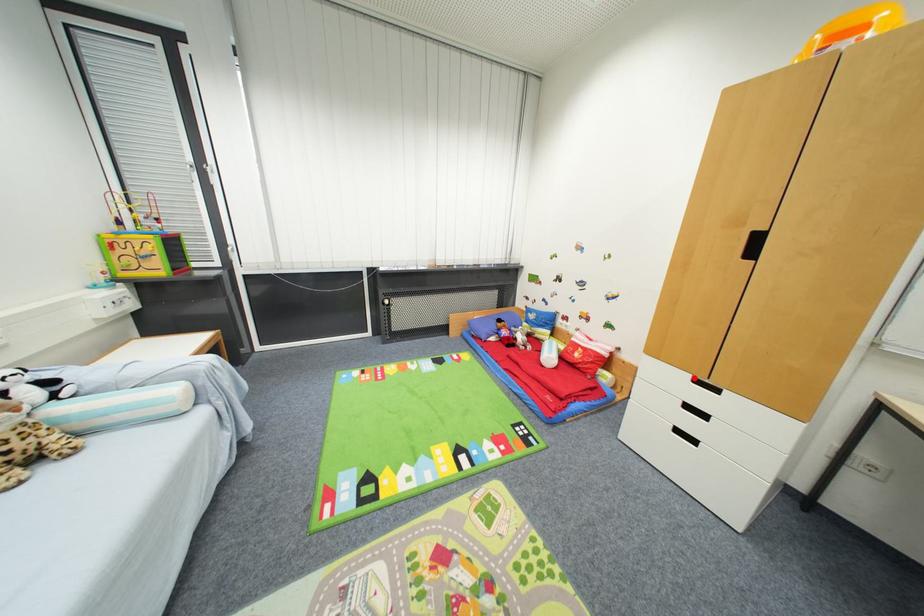
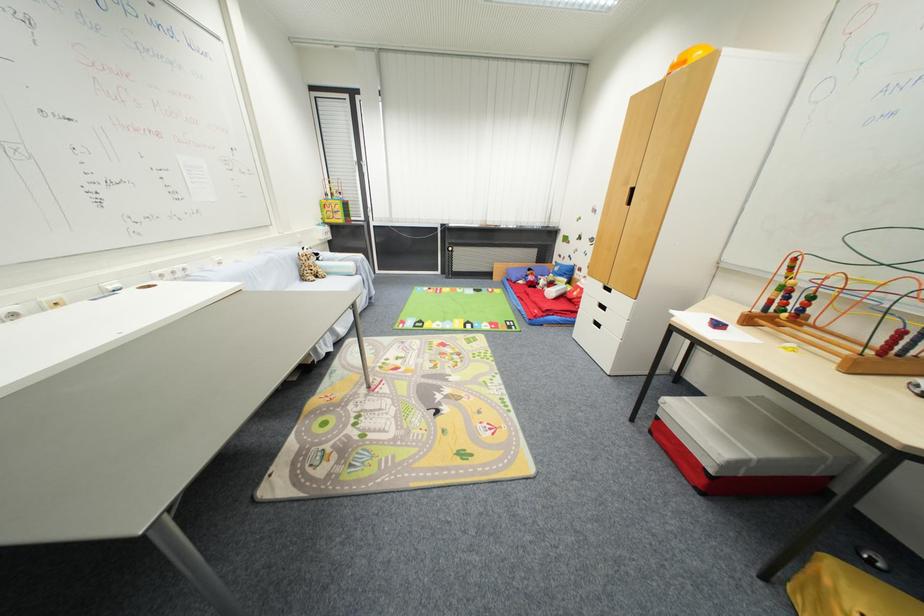
In the second image, find the point that corresponds to the highlighted location in the first image.

(606, 286)